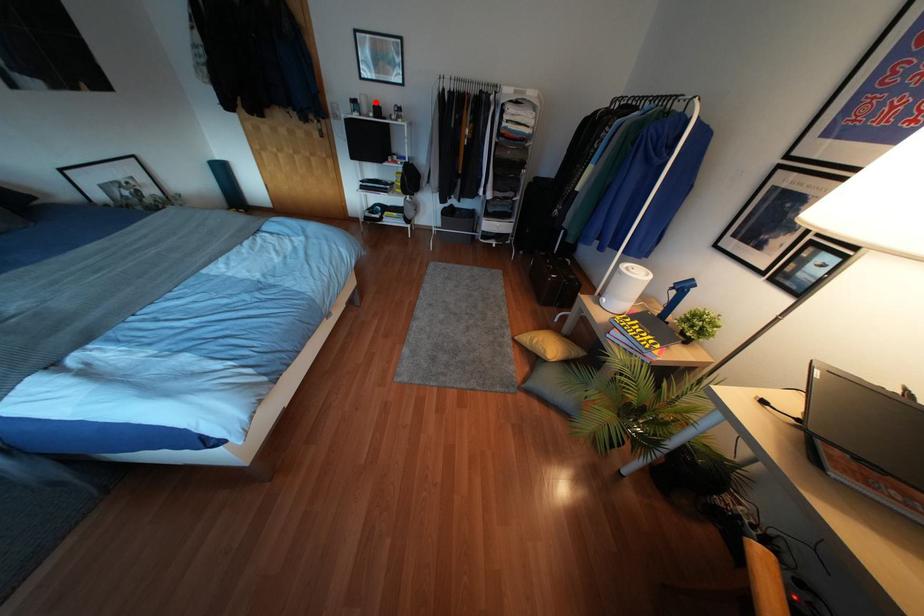
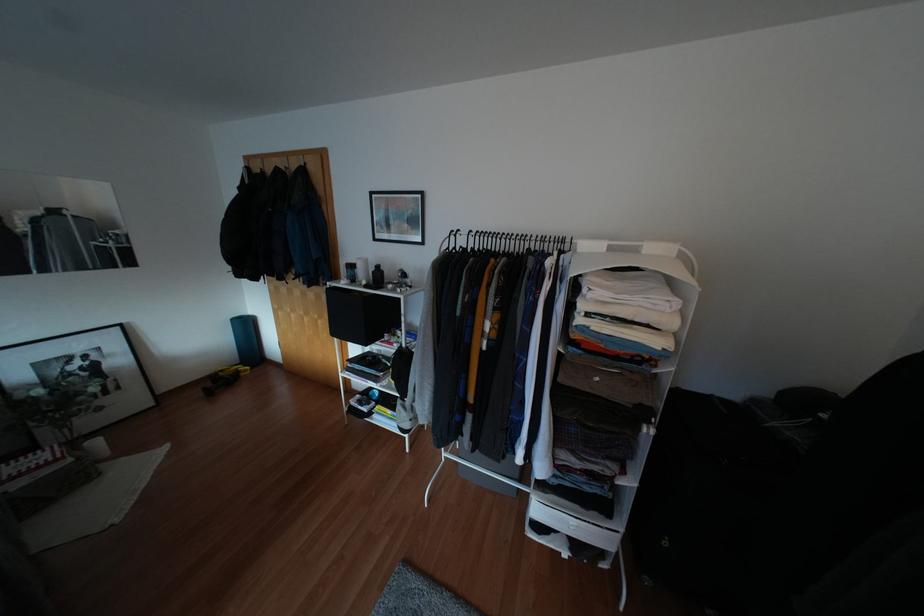
Question: I am providing you with two images of the same scene from different viewpoints. A red point is marked on the first image. Is the red point's position out of view in image 2?

Choices:
 (A) Yes
 (B) No

Answer: (B)